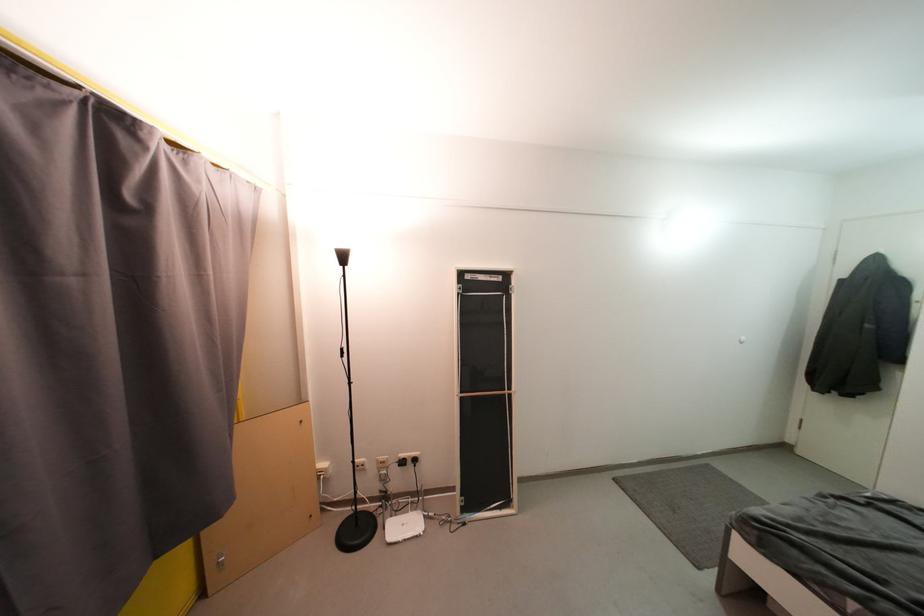
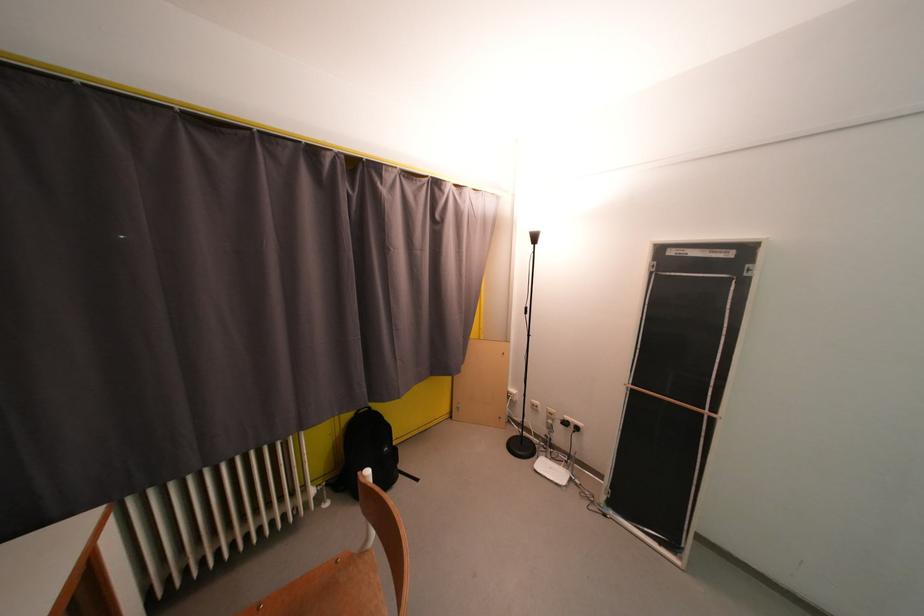
Locate, in the second image, the point that corresponds to (400,464) in the first image.

(565, 421)